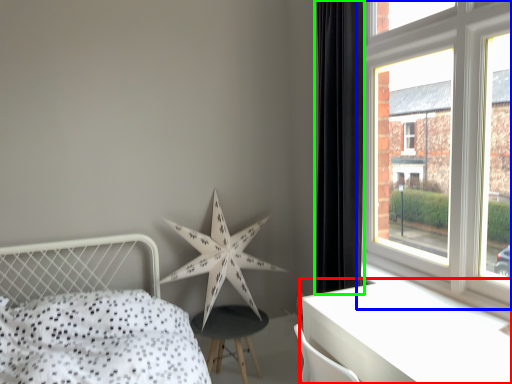
Question: Which is farther away from table (highlighted by a red box)? window (highlighted by a blue box) or curtain (highlighted by a green box)?

Choices:
 (A) window
 (B) curtain

Answer: (B)